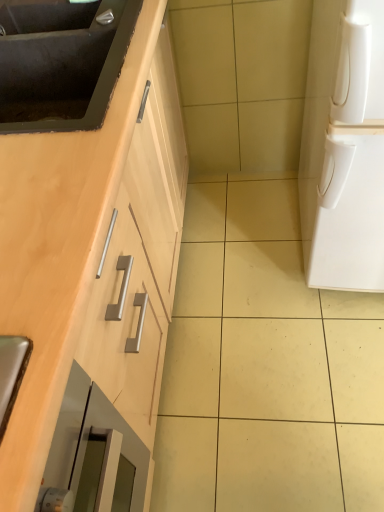
Identify the location of matte black sink at upper left, the 2th sink when ordered from top to bottom. Image resolution: width=384 pixels, height=512 pixels. (61, 63).

This screenshot has width=384, height=512. What do you see at coordinates (46, 17) in the screenshot?
I see `matte black sink at upper left, which is the 1th sink in top-to-bottom order` at bounding box center [46, 17].

The height and width of the screenshot is (512, 384). What do you see at coordinates (344, 149) in the screenshot? I see `white matte refrigerator at right` at bounding box center [344, 149].

The image size is (384, 512). I want to click on matte black sink at upper left, which is counted as the first sink, starting from the bottom, so click(x=61, y=63).

Is matte black sink at upper left, which is counted as the first sink, starting from the bottom, situated inside matte black sink at upper left, positioned as the 2th sink in bottom-to-top order, or outside?

matte black sink at upper left, which is counted as the first sink, starting from the bottom, is spatially situated outside matte black sink at upper left, positioned as the 2th sink in bottom-to-top order.

Considering the sizes of objects matte black sink at upper left, which is counted as the first sink, starting from the bottom, and matte black sink at upper left, positioned as the 2th sink in bottom-to-top order, in the image provided, who is smaller, matte black sink at upper left, which is counted as the first sink, starting from the bottom, or matte black sink at upper left, positioned as the 2th sink in bottom-to-top order,?

matte black sink at upper left, positioned as the 2th sink in bottom-to-top order, is smaller.

Is matte black sink at upper left, which is the 1th sink in top-to-bottom order, at the back of matte black sink at upper left, which is counted as the first sink, starting from the bottom?

No, matte black sink at upper left, which is counted as the first sink, starting from the bottom, is not facing the opposite direction of matte black sink at upper left, which is the 1th sink in top-to-bottom order.

Between matte black sink at upper left, the 2th sink when ordered from top to bottom, and matte black sink at upper left, which is the 1th sink in top-to-bottom order, which one appears on the left side from the viewer's perspective?

Positioned to the left is matte black sink at upper left, which is the 1th sink in top-to-bottom order.

In the scene shown: From the image's perspective, relative to matte black sink at upper left, the 2th sink when ordered from top to bottom, is white matte refrigerator at right above or below?

white matte refrigerator at right is below matte black sink at upper left, the 2th sink when ordered from top to bottom.

Considering the relative positions of white matte refrigerator at right and matte black sink at upper left, which is counted as the first sink, starting from the bottom, in the image provided, is white matte refrigerator at right to the left of matte black sink at upper left, which is counted as the first sink, starting from the bottom, from the viewer's perspective?

Incorrect, white matte refrigerator at right is not on the left side of matte black sink at upper left, which is counted as the first sink, starting from the bottom.

Would you say white matte refrigerator at right is inside or outside matte black sink at upper left, the 2th sink when ordered from top to bottom?

white matte refrigerator at right exists outside the volume of matte black sink at upper left, the 2th sink when ordered from top to bottom.

From a real-world perspective, is white matte refrigerator at right physically located above or below matte black sink at upper left, which is counted as the first sink, starting from the bottom?

white matte refrigerator at right is situated lower than matte black sink at upper left, which is counted as the first sink, starting from the bottom, in the real world.

Can you confirm if matte black sink at upper left, positioned as the 2th sink in bottom-to-top order, is shorter than white matte refrigerator at right?

Yes, matte black sink at upper left, positioned as the 2th sink in bottom-to-top order, is shorter than white matte refrigerator at right.

Considering the relative positions of matte black sink at upper left, positioned as the 2th sink in bottom-to-top order, and white matte refrigerator at right in the image provided, is matte black sink at upper left, positioned as the 2th sink in bottom-to-top order, to the left or to the right of white matte refrigerator at right?

From the image, it's evident that matte black sink at upper left, positioned as the 2th sink in bottom-to-top order, is to the left of white matte refrigerator at right.

Locate an element on the screen. This screenshot has height=512, width=384. home appliance in front of the matte black sink at upper left, which is the 1th sink in top-to-bottom order is located at coordinates click(x=344, y=149).

Is point (9, 10) closer or farther from the camera than point (357, 212)?

Point (9, 10) is closer to the camera than point (357, 212).

Does white matte refrigerator at right have a lesser height compared to matte black sink at upper left, positioned as the 2th sink in bottom-to-top order?

In fact, white matte refrigerator at right may be taller than matte black sink at upper left, positioned as the 2th sink in bottom-to-top order.

Are white matte refrigerator at right and matte black sink at upper left, which is the 1th sink in top-to-bottom order, located far from each other?

They are positioned close to each other.

Is point (351, 57) less distant than point (81, 19)?

Yes, point (351, 57) is closer to viewer.

Based on the photo, how different are the orientations of white matte refrigerator at right and matte black sink at upper left, positioned as the 2th sink in bottom-to-top order, in degrees?

white matte refrigerator at right and matte black sink at upper left, positioned as the 2th sink in bottom-to-top order, are facing 91.9 degrees away from each other.

Is matte black sink at upper left, positioned as the 2th sink in bottom-to-top order, to the left or to the right of matte black sink at upper left, which is counted as the first sink, starting from the bottom, in the image?

matte black sink at upper left, positioned as the 2th sink in bottom-to-top order, is positioned on matte black sink at upper left, which is counted as the first sink, starting from the bottom,'s left side.

Looking at this image, are matte black sink at upper left, which is the 1th sink in top-to-bottom order, and matte black sink at upper left, the 2th sink when ordered from top to bottom, beside each other?

No, matte black sink at upper left, which is the 1th sink in top-to-bottom order, is not touching matte black sink at upper left, the 2th sink when ordered from top to bottom.

Do you think matte black sink at upper left, positioned as the 2th sink in bottom-to-top order, is within matte black sink at upper left, which is counted as the first sink, starting from the bottom, or outside of it?

matte black sink at upper left, positioned as the 2th sink in bottom-to-top order, is not enclosed by matte black sink at upper left, which is counted as the first sink, starting from the bottom.

Which of these two, matte black sink at upper left, which is the 1th sink in top-to-bottom order, or matte black sink at upper left, the 2th sink when ordered from top to bottom, is bigger?

matte black sink at upper left, the 2th sink when ordered from top to bottom.

Is matte black sink at upper left, which is counted as the first sink, starting from the bottom, in contact with white matte refrigerator at right?

No, matte black sink at upper left, which is counted as the first sink, starting from the bottom, is not beside white matte refrigerator at right.

In the scene shown: Between matte black sink at upper left, the 2th sink when ordered from top to bottom, and white matte refrigerator at right, which one has smaller width?

matte black sink at upper left, the 2th sink when ordered from top to bottom.

From the image's perspective, which is above, matte black sink at upper left, the 2th sink when ordered from top to bottom, or white matte refrigerator at right?

matte black sink at upper left, the 2th sink when ordered from top to bottom, appears higher in the image.

Can you confirm if matte black sink at upper left, the 2th sink when ordered from top to bottom, is smaller than white matte refrigerator at right?

Yes.

Where is `sink below the matte black sink at upper left, positioned as the 2th sink in bottom-to-top order (from the image's perspective)`? Image resolution: width=384 pixels, height=512 pixels. sink below the matte black sink at upper left, positioned as the 2th sink in bottom-to-top order (from the image's perspective) is located at coordinates (61, 63).

Which sink is the 1st one when counting from the left side of the white matte refrigerator at right? Please provide its 2D coordinates.

[(61, 63)]

Based on their spatial positions, is white matte refrigerator at right or matte black sink at upper left, which is counted as the first sink, starting from the bottom, further from matte black sink at upper left, which is the 1th sink in top-to-bottom order?

white matte refrigerator at right is positioned further to the anchor matte black sink at upper left, which is the 1th sink in top-to-bottom order.

When comparing their distances from matte black sink at upper left, the 2th sink when ordered from top to bottom, does white matte refrigerator at right or matte black sink at upper left, positioned as the 2th sink in bottom-to-top order, seem further?

white matte refrigerator at right is positioned further to the anchor matte black sink at upper left, the 2th sink when ordered from top to bottom.

From the image, which object appears to be farther from matte black sink at upper left, the 2th sink when ordered from top to bottom, matte black sink at upper left, positioned as the 2th sink in bottom-to-top order, or white matte refrigerator at right?

Among the two, white matte refrigerator at right is located further to matte black sink at upper left, the 2th sink when ordered from top to bottom.

Considering their positions, is matte black sink at upper left, which is counted as the first sink, starting from the bottom, positioned closer to white matte refrigerator at right than matte black sink at upper left, which is the 1th sink in top-to-bottom order?

Among the two, matte black sink at upper left, which is counted as the first sink, starting from the bottom, is located nearer to white matte refrigerator at right.

Looking at the image, which one is located further to white matte refrigerator at right, matte black sink at upper left, positioned as the 2th sink in bottom-to-top order, or matte black sink at upper left, the 2th sink when ordered from top to bottom?

matte black sink at upper left, positioned as the 2th sink in bottom-to-top order, lies further to white matte refrigerator at right than the other object.

From the image, which object appears to be farther from matte black sink at upper left, positioned as the 2th sink in bottom-to-top order, matte black sink at upper left, which is counted as the first sink, starting from the bottom, or white matte refrigerator at right?

white matte refrigerator at right is further to matte black sink at upper left, positioned as the 2th sink in bottom-to-top order.

You are a GUI agent. You are given a task and a screenshot of the screen. Output one action in this format:
    pyautogui.click(x=<x>, y=<y>)
    Task: Click on the sink between matte black sink at upper left, positioned as the 2th sink in bottom-to-top order, and white matte refrigerator at right
    This screenshot has width=384, height=512.
    Given the screenshot: What is the action you would take?
    pyautogui.click(x=61, y=63)